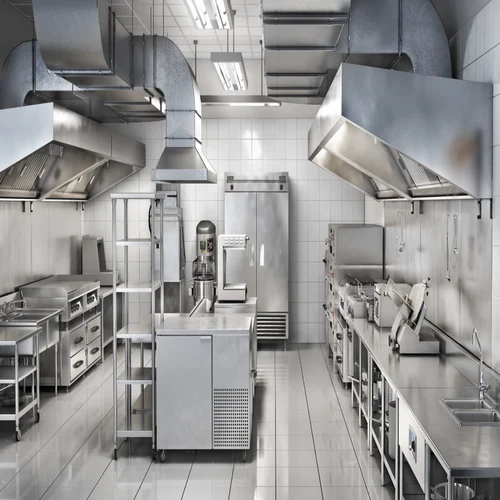
You are a GUI agent. You are given a task and a screenshot of the screen. Output one action in this format:
    pyautogui.click(x=<x>, y=<y>)
    Task: Click on the cook top
    The width and height of the screenshot is (500, 500).
    Given the screenshot: What is the action you would take?
    pyautogui.click(x=59, y=285)